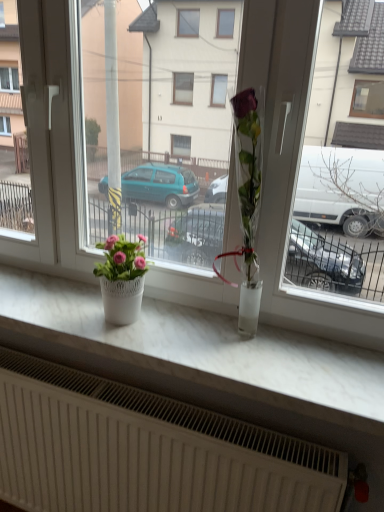
Question: Should I look upward or downward to see pink matte flower pot at left?

Choices:
 (A) down
 (B) up

Answer: (A)

Question: Is white marble counter top at center at the right side of transparent glass vase at center?

Choices:
 (A) no
 (B) yes

Answer: (A)

Question: Does white marble counter top at center come behind transparent glass vase at center?

Choices:
 (A) yes
 (B) no

Answer: (A)

Question: Could you tell me if white marble counter top at center is facing transparent glass vase at center?

Choices:
 (A) yes
 (B) no

Answer: (B)

Question: Is white marble counter top at center not near transparent glass vase at center?

Choices:
 (A) yes
 (B) no

Answer: (B)

Question: Can you confirm if white marble counter top at center is shorter than transparent glass vase at center?

Choices:
 (A) yes
 (B) no

Answer: (A)

Question: Considering the relative sizes of white marble counter top at center and transparent glass vase at center in the image provided, is white marble counter top at center smaller than transparent glass vase at center?

Choices:
 (A) no
 (B) yes

Answer: (B)

Question: From a real-world perspective, is pink matte flower pot at left physically above transparent glass vase at center?

Choices:
 (A) yes
 (B) no

Answer: (B)

Question: From the image's perspective, is pink matte flower pot at left located above transparent glass vase at center?

Choices:
 (A) yes
 (B) no

Answer: (B)

Question: Is pink matte flower pot at left facing towards transparent glass vase at center?

Choices:
 (A) no
 (B) yes

Answer: (A)

Question: Could transparent glass vase at center be considered to be inside pink matte flower pot at left?

Choices:
 (A) no
 (B) yes

Answer: (A)

Question: From the image's perspective, does pink matte flower pot at left appear lower than transparent glass vase at center?

Choices:
 (A) yes
 (B) no

Answer: (A)

Question: Is pink matte flower pot at left at the right side of transparent glass vase at center?

Choices:
 (A) no
 (B) yes

Answer: (A)

Question: Is pink matte flower pot at left wider than white marble counter top at center?

Choices:
 (A) no
 (B) yes

Answer: (A)